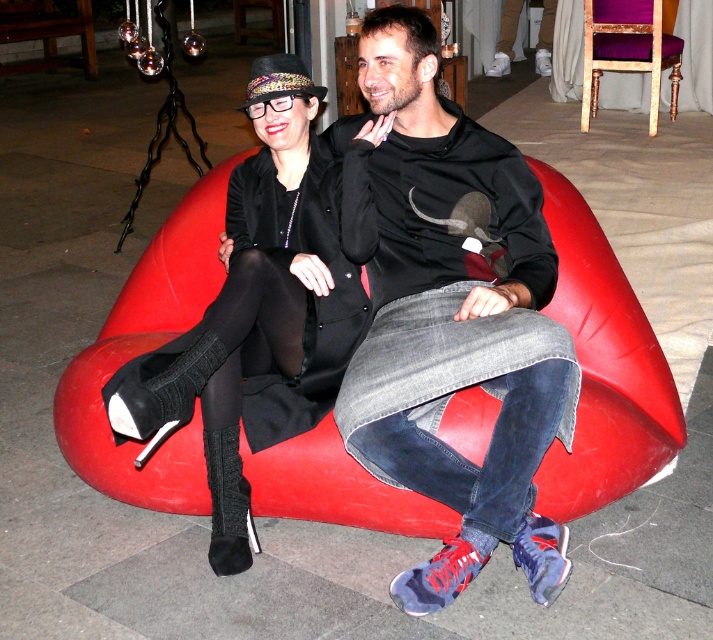
Is point (451, 128) positioned before point (292, 284)?

No.

Which is in front, point (416, 355) or point (174, 406)?

Point (174, 406) is in front.

Locate an element on the screen. The width and height of the screenshot is (713, 640). black hoodie at center is located at coordinates [456, 320].

Does red fabric bean bag at center have a smaller size compared to purple velvet chair at upper right?

No.

Is red fabric bean bag at center in front of purple velvet chair at upper right?

Yes, it is.

The width and height of the screenshot is (713, 640). I want to click on red fabric bean bag at center, so tap(602, 369).

Does black hoodie at center appear on the left side of red fabric bean bag at center?

Incorrect, black hoodie at center is not on the left side of red fabric bean bag at center.

Is black hoodie at center thinner than red fabric bean bag at center?

Yes, black hoodie at center is thinner than red fabric bean bag at center.

Image resolution: width=713 pixels, height=640 pixels. What do you see at coordinates (456, 320) in the screenshot? I see `black hoodie at center` at bounding box center [456, 320].

Identify the location of black hoodie at center. (456, 320).